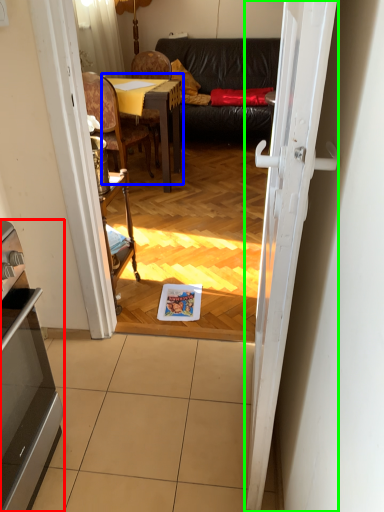
Question: Estimate the real-world distances between objects in this image. Which object is closer to appliance (highlighted by a red box), table (highlighted by a blue box) or door (highlighted by a green box)?

Choices:
 (A) table
 (B) door

Answer: (B)